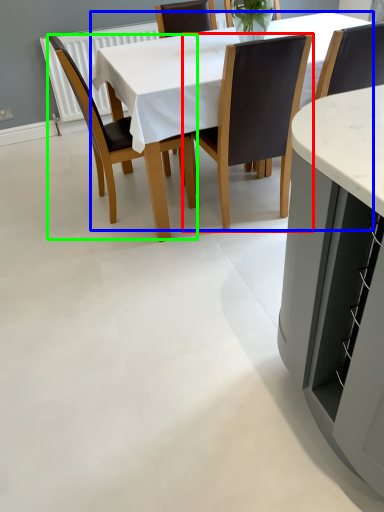
Question: Which is farther away from chair (highlighted by a red box)? kitchen & dining room table (highlighted by a blue box) or chair (highlighted by a green box)?

Choices:
 (A) kitchen & dining room table
 (B) chair

Answer: (B)